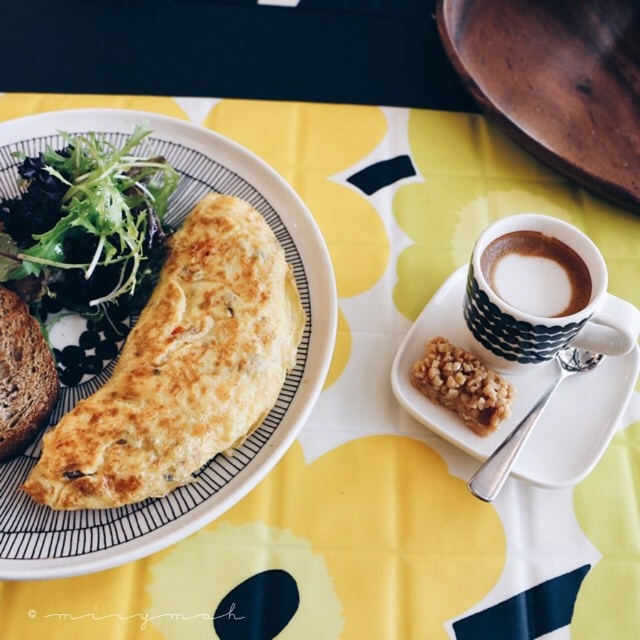
You are a chef who needs to reach both the wooden spoon at upper right and the crumbly brown bar at center during a cooking demonstration. Given that your arm can comfortably reach up to 20 inches, can you comfortably reach both items without moving your position?

The wooden spoon at upper right and the crumbly brown bar at center are 20.10 inches apart from each other. Since your arm can only reach up to 20 inches, you cannot comfortably reach both items without moving your position because the distance between them exceeds your reach.

You are setting the table for breakfast. You want to place the dark brown ceramic cup at upper right so that it is to the right of the crumbly brown bar at center. Is the current arrangement already correct?

Yes, the dark brown ceramic cup at upper right is already positioned to the right of the crumbly brown bar at center according to the description.